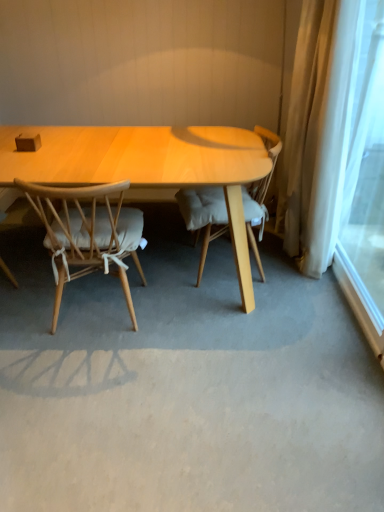
Where is `free location in front of light wood chair with cushion at left, arranged as the 2th chair when viewed from the right`? This screenshot has height=512, width=384. free location in front of light wood chair with cushion at left, arranged as the 2th chair when viewed from the right is located at coordinates (89, 379).